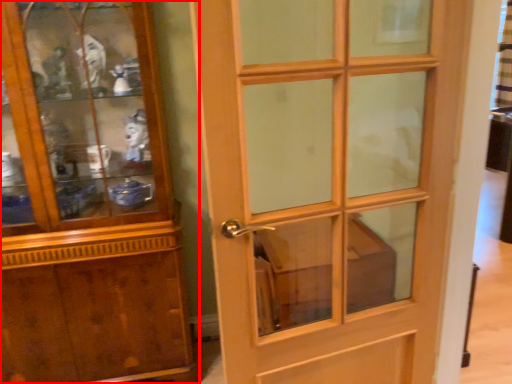
Question: From the image's perspective, what is the correct spatial relationship of cupboard (annotated by the red box) in relation to door?

Choices:
 (A) above
 (B) below

Answer: (A)